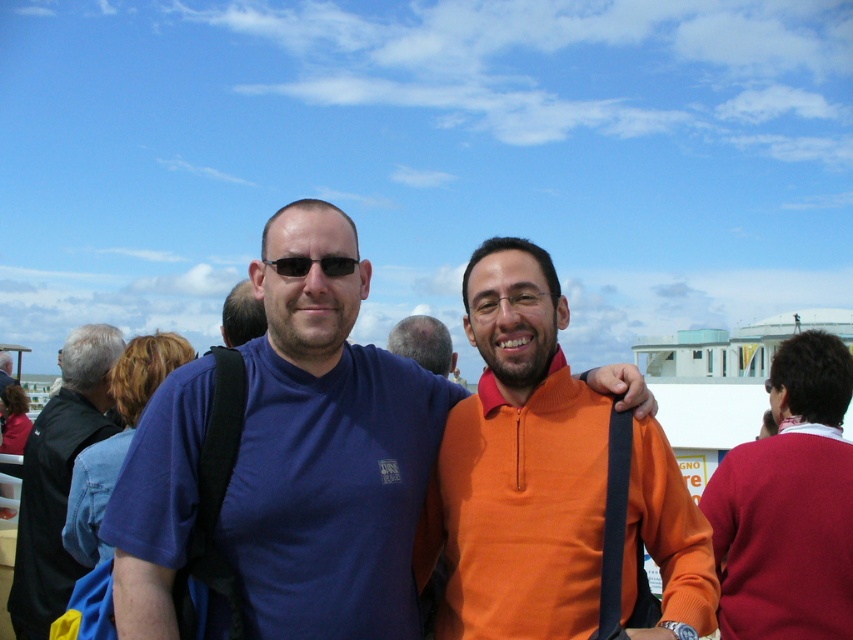
Question: Does orange matte sweater at right appear on the right side of black plastic sunglasses at center?

Choices:
 (A) yes
 (B) no

Answer: (A)

Question: Where is blue cotton shirt at left located in relation to smooth bald head at center in the image?

Choices:
 (A) below
 (B) above

Answer: (A)

Question: Which object is positioned closest to the black plastic sunglasses at center?

Choices:
 (A) smooth bald head at center
 (B) blue matte t-shirt at center
 (C) blue cotton shirt at left

Answer: (B)

Question: Which of these objects is positioned farthest from the orange fleece at center?

Choices:
 (A) smooth bald head at center
 (B) blue cotton shirt at left
 (C) black plastic sunglasses at center

Answer: (B)

Question: Is blue matte t-shirt at center below black plastic sunglasses at center?

Choices:
 (A) no
 (B) yes

Answer: (B)

Question: Which object is the farthest from the blue cotton shirt at left?

Choices:
 (A) orange matte sweater at right
 (B) black plastic sunglasses at center
 (C) smooth bald head at center
 (D) orange fleece at center

Answer: (A)